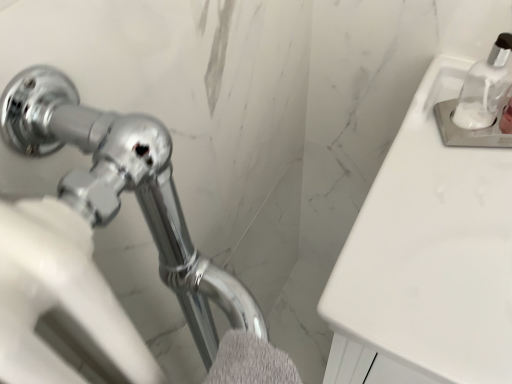
Question: Would you say gray fluffy bath towel at lower center is inside or outside white glossy sink at upper right?

Choices:
 (A) outside
 (B) inside

Answer: (A)

Question: Is gray fluffy bath towel at lower center bigger or smaller than white glossy sink at upper right?

Choices:
 (A) small
 (B) big

Answer: (A)

Question: Considering the real-world distances, which object is closest to the gray fluffy bath towel at lower center?

Choices:
 (A) clear glass soap dispenser at upper right
 (B) white glossy sink at upper right

Answer: (B)

Question: Which is nearer to the clear glass soap dispenser at upper right?

Choices:
 (A) gray fluffy bath towel at lower center
 (B) white glossy sink at upper right

Answer: (B)